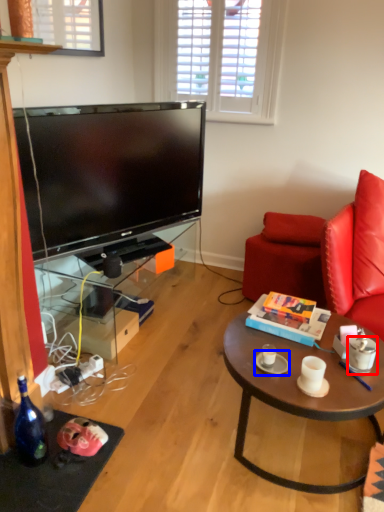
Question: Which of the following is the closest to the observer, coffee cup (highlighted by a red box) or saucer (highlighted by a blue box)?

Choices:
 (A) coffee cup
 (B) saucer

Answer: (A)